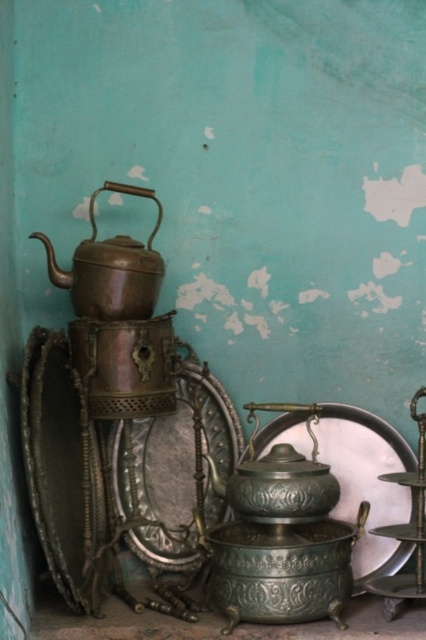
Which is above, polished silver plate at center or green patina plate at center?

polished silver plate at center is above.

Can you confirm if polished silver plate at center is smaller than green patina plate at center?

Yes.

Is point (210, 490) farther from viewer compared to point (265, 404)?

Yes, point (210, 490) is behind point (265, 404).

Find the location of a particular element. The height and width of the screenshot is (640, 426). polished silver plate at center is located at coordinates (178, 467).

Can you confirm if polished silver plate at center is wider than bronze metallic teapot at upper left?

Indeed, polished silver plate at center has a greater width compared to bronze metallic teapot at upper left.

What do you see at coordinates (178, 467) in the screenshot? This screenshot has width=426, height=640. I see `polished silver plate at center` at bounding box center [178, 467].

Where is `polished silver plate at center`? polished silver plate at center is located at coordinates (178, 467).

Find the location of `polished silver plate at center`. polished silver plate at center is located at coordinates (178, 467).

Between point (189, 445) and point (247, 464), which one is positioned in front?

Point (247, 464)

Looking at this image, does polished silver plate at center have a greater width compared to polished bronze teapot at center?

Indeed, polished silver plate at center has a greater width compared to polished bronze teapot at center.

Does point (132, 436) come in front of point (221, 486)?

No, it is behind (221, 486).

Locate an element on the screen. polished silver plate at center is located at coordinates (178, 467).